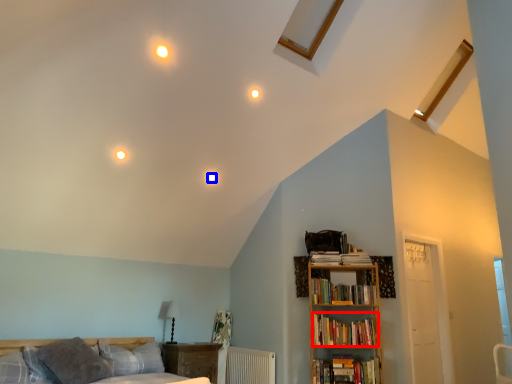
Question: Which point is further to the camera, book (highlighted by a red box) or lighting (highlighted by a blue box)?

Choices:
 (A) book
 (B) lighting

Answer: (B)